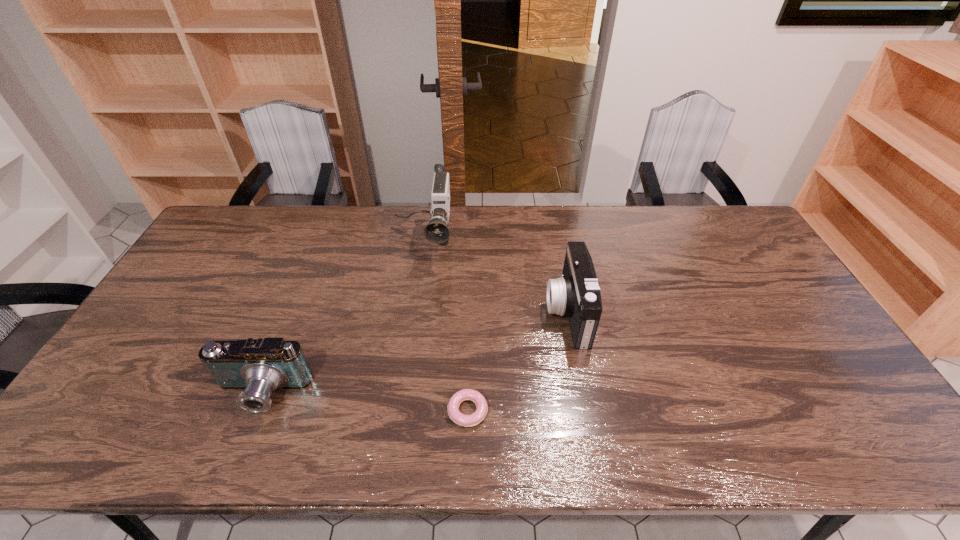
This screenshot has width=960, height=540. In order to click on vacant space located 0.070m on the lens of the second tallest camcorder in this screenshot , I will do `click(523, 312)`.

The width and height of the screenshot is (960, 540). I want to click on free spot located 0.340m on the lens of the second tallest camcorder, so click(431, 312).

Where is `vacant space located 0.280m on the right of the doughnut`? vacant space located 0.280m on the right of the doughnut is located at coordinates (603, 411).

This screenshot has width=960, height=540. What are the coordinates of `object that is at the far edge` in the screenshot? It's located at (436, 231).

Locate an element on the screen. The width and height of the screenshot is (960, 540). object present at the near edge is located at coordinates (455, 415).

Where is `blank area at the far edge`? The height and width of the screenshot is (540, 960). blank area at the far edge is located at coordinates (470, 235).

This screenshot has height=540, width=960. In order to click on blank space at the near edge of the desktop in this screenshot , I will do [621, 450].

In the image, there is a desktop. At what (x,y) coordinates should I click in order to perform the action: click on vacant space at the left edge. Please return your answer as a coordinate pair (x, y). Looking at the image, I should click on (165, 346).

Identify the location of free space at the right edge. This screenshot has width=960, height=540. (728, 260).

At what (x,y) coordinates should I click in order to perform the action: click on vacant space at the near left corner. Please return your answer as a coordinate pair (x, y). This screenshot has width=960, height=540. Looking at the image, I should click on (121, 443).